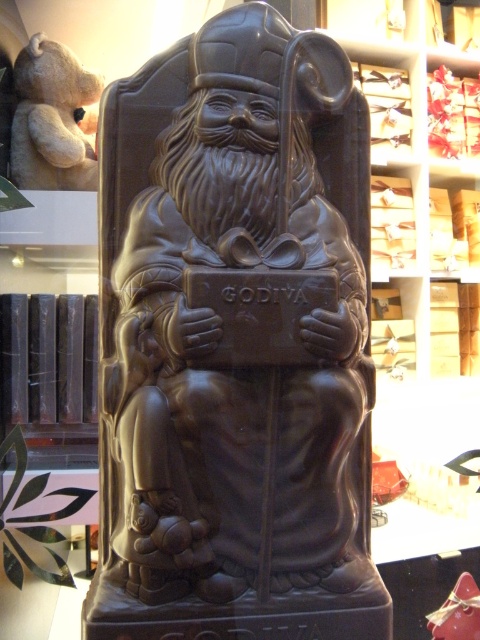
You are a photographer setting up a shoot in the shop. You need to decide whether to use a wide or standard lens based on the size of the objects. Since the matte chocolate sculpture at center and the soft beige teddy bear at upper left are in the frame, which object requires a wider lens to capture its full size?

The matte chocolate sculpture at center requires a wider lens to capture its full size because its width is larger than the soft beige teddy bear at upper left.